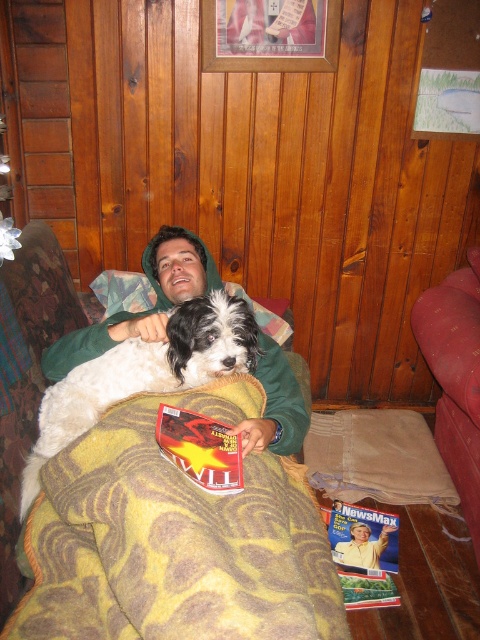
Is white fluffy dog at upper center taller than velvet maroon couch at lower right?

In fact, white fluffy dog at upper center may be shorter than velvet maroon couch at lower right.

At what (x,y) coordinates should I click in order to perform the action: click on white fluffy dog at upper center. Please return your answer as a coordinate pair (x, y). The image size is (480, 640). Looking at the image, I should click on (144, 372).

Who is higher up, yellow fleece blanket at center or white fluffy dog at upper center?

Positioned higher is white fluffy dog at upper center.

Does point (61, 493) lie in front of point (195, 330)?

Yes, it is in front of point (195, 330).

Between point (33, 627) and point (220, 342), which one is positioned behind?

The point (220, 342) is behind.

Locate an element on the screen. This screenshot has width=480, height=640. yellow fleece blanket at center is located at coordinates (173, 540).

Who is positioned more to the right, yellow fleece blanket at center or green fleece hoodie at center?

yellow fleece blanket at center is more to the right.

Image resolution: width=480 pixels, height=640 pixels. Identify the location of yellow fleece blanket at center. (173, 540).

Image resolution: width=480 pixels, height=640 pixels. Identify the location of yellow fleece blanket at center. (173, 540).